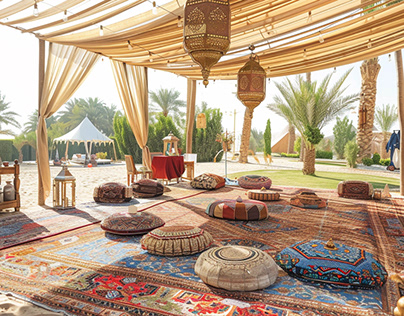
This screenshot has width=404, height=316. Identify the location of chair. (134, 164), (145, 157), (188, 164).